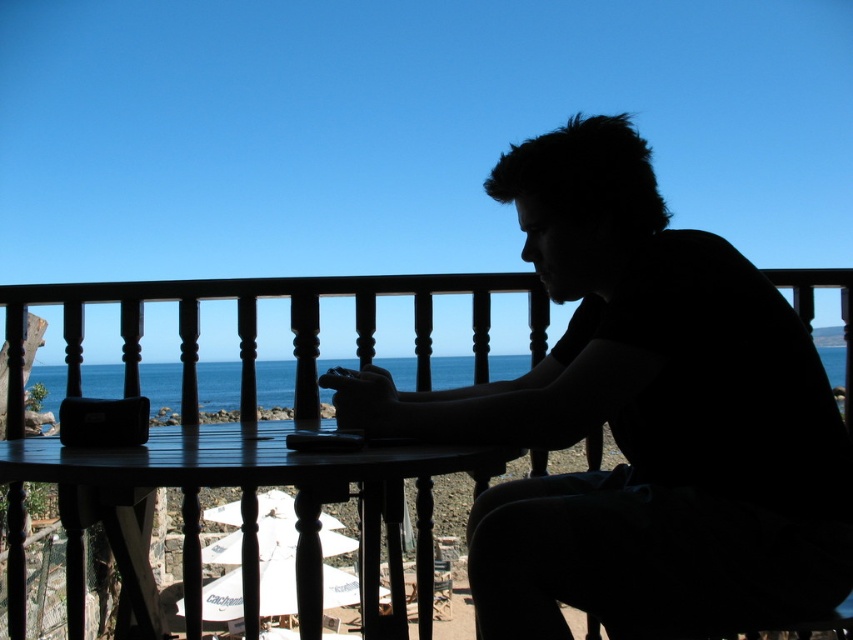
Question: Observing the image, what is the correct spatial positioning of wooden at center in reference to dark wood table at center?

Choices:
 (A) above
 (B) below

Answer: (A)

Question: Does wooden at center have a smaller size compared to dark wood table at center?

Choices:
 (A) no
 (B) yes

Answer: (A)

Question: Which of the following is the closest to the observer?

Choices:
 (A) (619, 252)
 (B) (361, 456)

Answer: (B)

Question: Can you confirm if wooden at center is positioned below blue water at center?

Choices:
 (A) no
 (B) yes

Answer: (A)

Question: Which point is farther to the camera?

Choices:
 (A) silhouette at center
 (B) blue water at center

Answer: (B)

Question: Which point appears farthest from the camera in this image?

Choices:
 (A) (494, 464)
 (B) (200, 384)
 (C) (302, 406)
 (D) (546, 624)

Answer: (B)